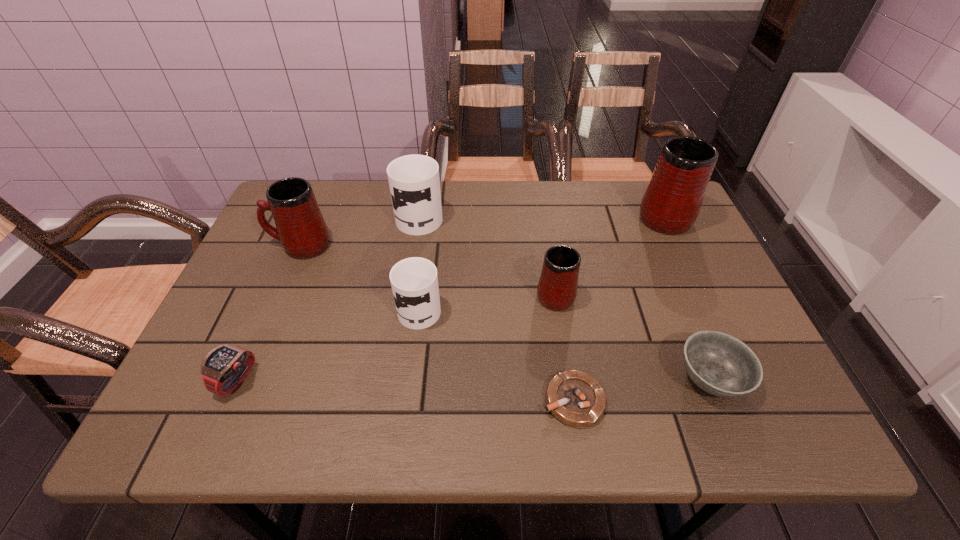
Identify the location of vacant space located on the back of the red watch. (286, 269).

This screenshot has height=540, width=960. In order to click on vacant area situated 0.250m on the left of the second shortest object in this screenshot , I will do `click(552, 379)`.

In order to click on vacant space located on the back of the shortest object in this screenshot , I will do `click(561, 317)`.

What are the coordinates of `watch that is at the near edge` in the screenshot? It's located at (224, 368).

Image resolution: width=960 pixels, height=540 pixels. Identify the location of bowl located in the near edge section of the desktop. (720, 364).

Where is `ashtray situated at the near edge`? This screenshot has width=960, height=540. ashtray situated at the near edge is located at coordinates pos(577,399).

Find the location of a particular element. mug at the left edge is located at coordinates (300, 227).

I want to click on watch located at the left edge, so click(x=224, y=368).

Locate an element on the screen. This screenshot has width=960, height=540. mug that is positioned at the right edge is located at coordinates (x=671, y=203).

You are a GUI agent. You are given a task and a screenshot of the screen. Output one action in this format:
    pyautogui.click(x=<x>, y=<y>)
    Task: Click on the bowl at the right edge
    This screenshot has height=540, width=960.
    Given the screenshot: What is the action you would take?
    pyautogui.click(x=720, y=364)